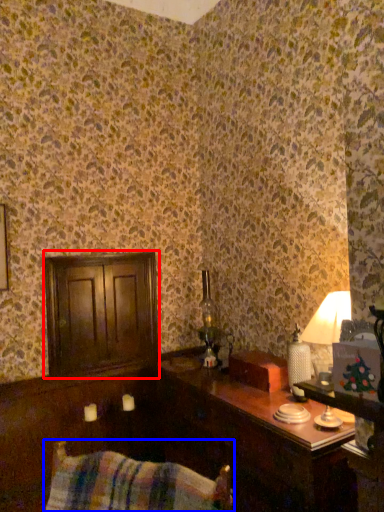
Question: Which point is further to the camera, dresser (highlighted by a red box) or swivel chair (highlighted by a blue box)?

Choices:
 (A) dresser
 (B) swivel chair

Answer: (A)